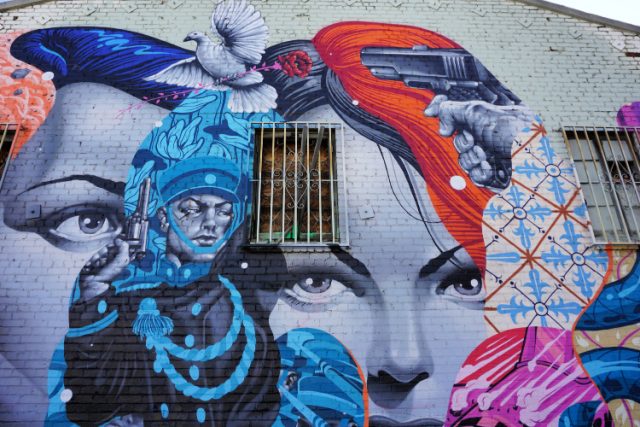
Identify the location of windows. Image resolution: width=640 pixels, height=427 pixels. (294, 204), (6, 135), (604, 173).